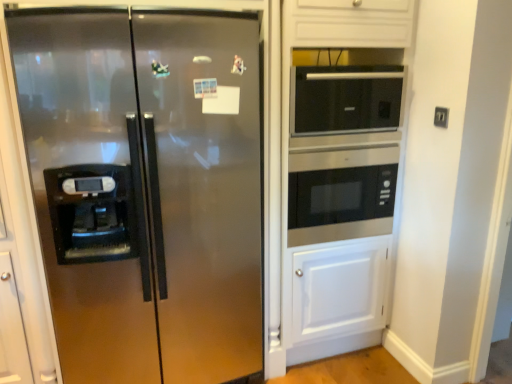
Question: Considering the positions of point click(254, 253) and point click(437, 110), is point click(254, 253) closer or farther from the camera than point click(437, 110)?

Choices:
 (A) closer
 (B) farther

Answer: (B)

Question: Considering the positions of stainless steel refrigerator at left and black plastic electric outlet at upper right in the image, is stainless steel refrigerator at left taller or shorter than black plastic electric outlet at upper right?

Choices:
 (A) short
 (B) tall

Answer: (B)

Question: Which of these objects is positioned farthest from the stainless steel refrigerator at left?

Choices:
 (A) black glass microwave at upper right, which appears as the 2th microwave oven when ordered from the bottom
 (B) stainless steel microwave at center, which is the second microwave oven in top-to-bottom order
 (C) black plastic electric outlet at upper right

Answer: (C)

Question: Based on their relative distances, which object is farther from the black glass microwave at upper right, the first microwave oven positioned from the top?

Choices:
 (A) stainless steel microwave at center, which is the second microwave oven in top-to-bottom order
 (B) stainless steel refrigerator at left
 (C) black plastic electric outlet at upper right

Answer: (B)